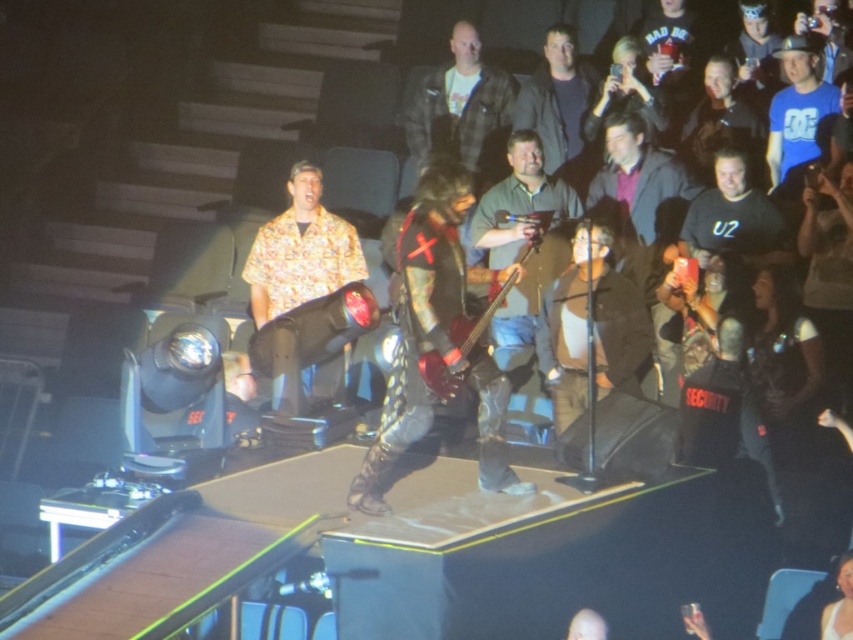
You are standing at the point marked by the coordinates point (515,161) in the concert hall. You want to toss a small object to a friend who is standing 10 meters away from you. Can you reach your friend with this throw?

The distance between you and your friend is 10.15 meters. Since you want to toss the object 10 meters, you can almost reach your friend, but you might need to throw a bit harder to cover the extra 0.15 meters.

You are standing in the concert venue and want to move from the point closer to the stage to the point farther away. Which path should you take between the two points, point [399,374] and point [346,225]?

You should move from point [399,374] to point [346,225] because point [399,374] is closer to the viewer and point [346,225] is farther away.